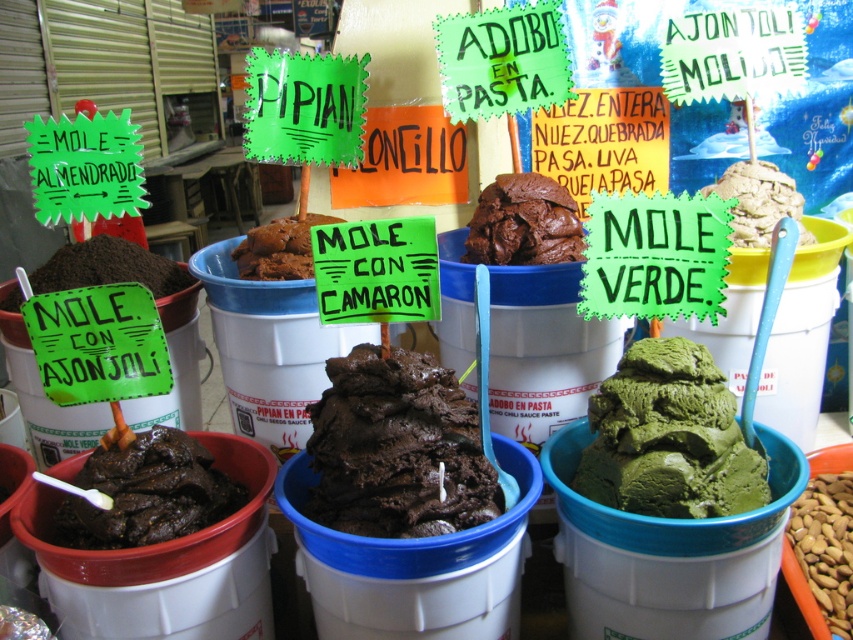
You are at a dessert shop and want to order the dark brown creamy ice cream at center. The shop uses a coordinate system where the bottom left corner is the origin. Can you confirm if the point at coordinates [397,449] falls within the boundaries of the dark brown creamy ice cream at center?

The point at coordinates [397,449] is on the dark brown creamy ice cream at center, so yes, it falls within its boundaries.

You are at an ice cream shop and want to choose between the green matte ice cream at center and the brown powder at left. Which one has a greater height?

The green matte ice cream at center is taller than the brown powder at left.